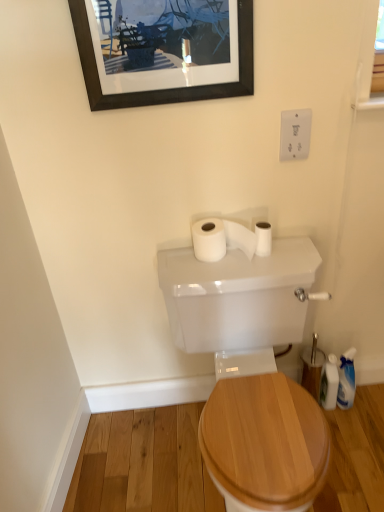
Question: Choose the correct answer: Is white plastic bottle at lower right inside white plastic outlet at upper right or outside it?

Choices:
 (A) outside
 (B) inside

Answer: (A)

Question: In the image, is white plastic bottle at lower right on the left side or the right side of white plastic outlet at upper right?

Choices:
 (A) left
 (B) right

Answer: (B)

Question: Which of these objects is positioned closest to the white plastic bottle at lower right?

Choices:
 (A) white matte toilet paper at upper center, which appears as the first toilet paper when viewed from the left
 (B) black matte picture frame at upper center
 (C) white plastic outlet at upper right
 (D) white matte toilet paper at upper center, placed as the 1th toilet paper when sorted from right to left
 (E) white glossy toilet tank at center

Answer: (E)

Question: Estimate the real-world distances between objects in this image. Which object is closer to the white plastic outlet at upper right?

Choices:
 (A) white plastic bottle at lower right
 (B) white glossy toilet tank at center
 (C) white matte toilet paper at upper center, the second toilet paper in the left-to-right sequence
 (D) white matte toilet paper at upper center, which appears as the 2th toilet paper when viewed from the right
 (E) black matte picture frame at upper center

Answer: (C)